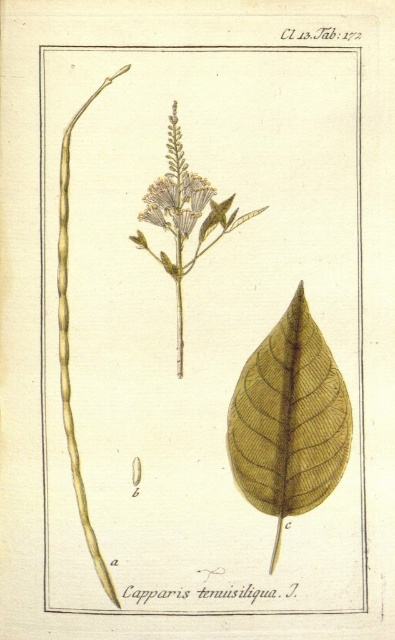
You are examining the botanical illustration of Capparis tenuisilqua in section B. You notice two points labeled as point 1 at coordinates point (319, 404) and point 2 at coordinates point (167, 188). Which point is closer to your viewpoint?

Point (319, 404) is closer to the camera than point (167, 188).

In the botanical illustration of Capparis tenuisilqua, there is a brown textured leaf at center and a point labeled as point (289, 419). Which of these two elements is the brown textured leaf at center located closer to the bottom of the image?

The brown textured leaf at center is represented by point (289, 419), so they are the same element. Therefore, the brown textured leaf at center is exactly at the position of point (289, 419), so there is no difference in their vertical positions.

Looking at the botanical illustration of Capparis tenuisilqua, there are two flowers in section B. The matte white flower at center and the light yellow textured flower at center. Which one is positioned to the right?

The matte white flower at center is positioned to the right of the light yellow textured flower at center.